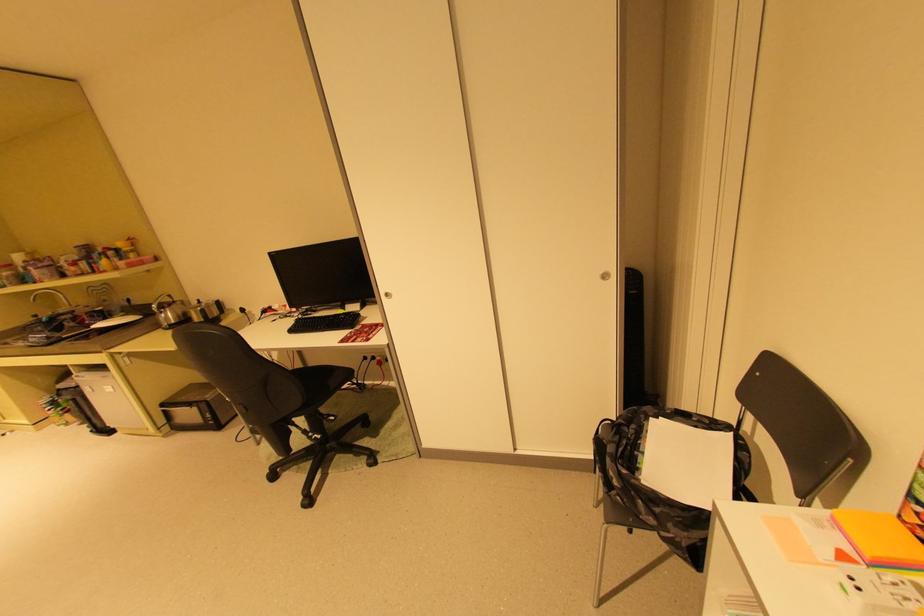
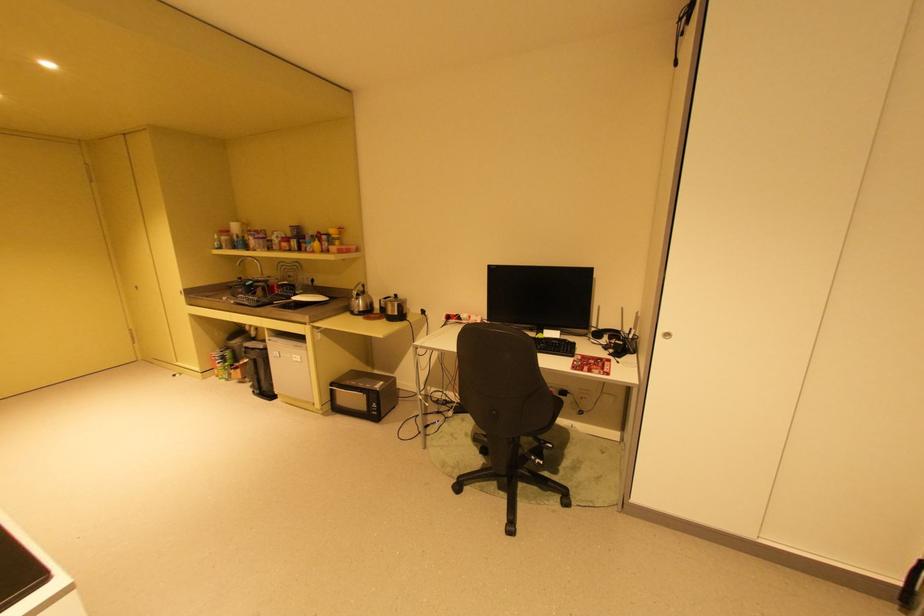
Where in the second image is the point corresponding to point 100,431 from the first image?

(261, 392)